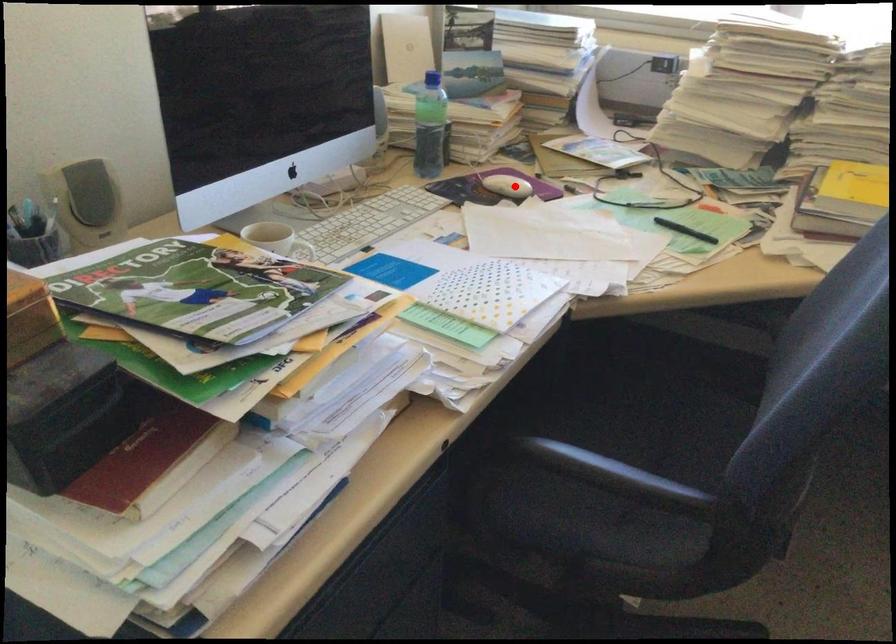
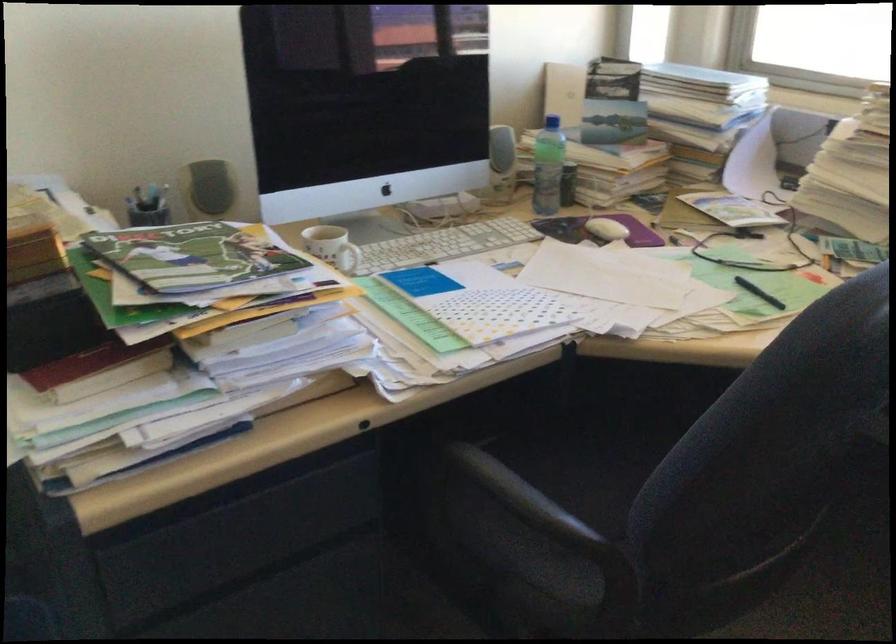
The point at the highlighted location is marked in the first image. Where is the corresponding point in the second image?

(606, 229)